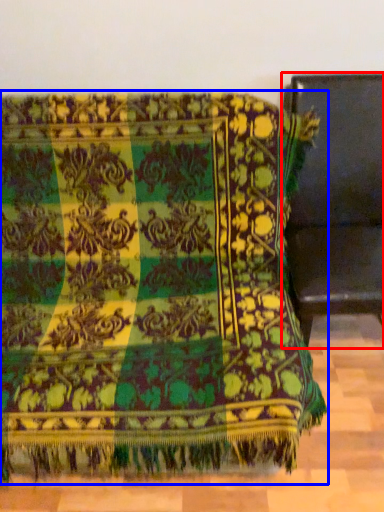
Question: Which of the following is the closest to the observer, furniture (highlighted by a red box) or furniture (highlighted by a blue box)?

Choices:
 (A) furniture
 (B) furniture

Answer: (B)